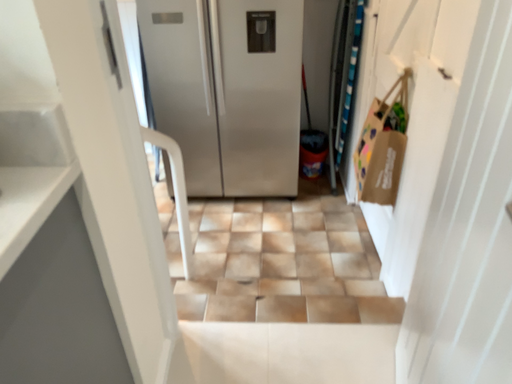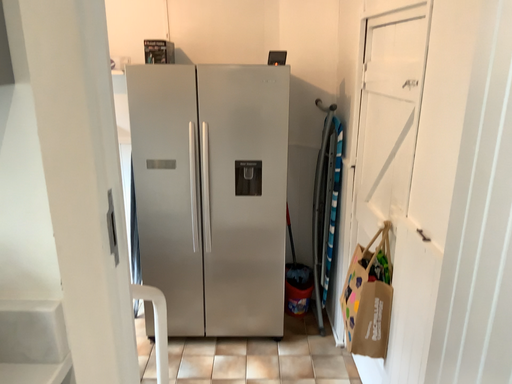
Question: How did the camera likely rotate when shooting the video?

Choices:
 (A) rotated downward
 (B) rotated upward

Answer: (B)